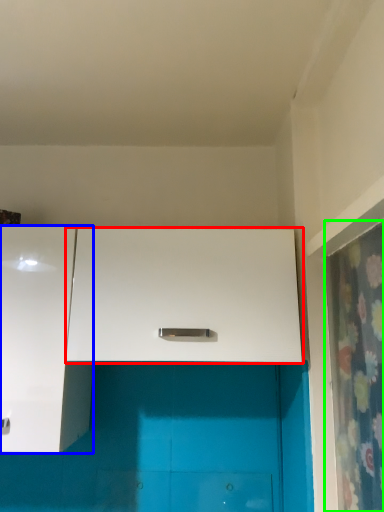
Question: Which is farther away from cabinetry (highlighted by a red box)? cabinetry (highlighted by a blue box) or shower curtain (highlighted by a green box)?

Choices:
 (A) cabinetry
 (B) shower curtain

Answer: (B)